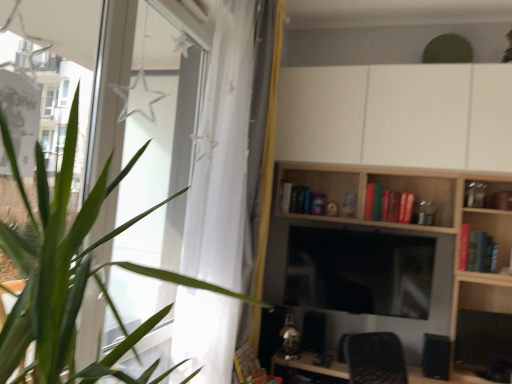
Question: Considering the relative sizes of green leafy plant at left and white sheer curtain at left in the image provided, is green leafy plant at left shorter than white sheer curtain at left?

Choices:
 (A) yes
 (B) no

Answer: (A)

Question: Is green leafy plant at left facing away from white sheer curtain at left?

Choices:
 (A) yes
 (B) no

Answer: (B)

Question: Can you confirm if green leafy plant at left is thinner than white sheer curtain at left?

Choices:
 (A) yes
 (B) no

Answer: (B)

Question: Does green leafy plant at left lie in front of white sheer curtain at left?

Choices:
 (A) no
 (B) yes

Answer: (B)

Question: Does green leafy plant at left appear on the left side of white sheer curtain at left?

Choices:
 (A) no
 (B) yes

Answer: (B)

Question: Considering the positions of green matte book at upper center, positioned as the second book in back-to-front order, and white matte cabinet at upper center in the image, is green matte book at upper center, positioned as the second book in back-to-front order, wider or thinner than white matte cabinet at upper center?

Choices:
 (A) thin
 (B) wide

Answer: (A)

Question: Is green matte book at upper center, which is the second book from right to left, spatially inside white matte cabinet at upper center, or outside of it?

Choices:
 (A) inside
 (B) outside

Answer: (B)

Question: Is point (370, 213) closer or farther from the camera than point (335, 105)?

Choices:
 (A) farther
 (B) closer

Answer: (A)

Question: From a real-world perspective, is green matte book at upper center, the second book when ordered from front to back, physically located above or below white matte cabinet at upper center?

Choices:
 (A) above
 (B) below

Answer: (B)

Question: Considering the positions of white matte cabinet at upper center and white sheer curtain at left in the image, is white matte cabinet at upper center wider or thinner than white sheer curtain at left?

Choices:
 (A) wide
 (B) thin

Answer: (A)

Question: In terms of height, does white matte cabinet at upper center look taller or shorter compared to white sheer curtain at left?

Choices:
 (A) tall
 (B) short

Answer: (B)

Question: From the image's perspective, is white matte cabinet at upper center positioned above or below white sheer curtain at left?

Choices:
 (A) below
 (B) above

Answer: (B)

Question: Is point tap(343, 150) closer or farther from the camera than point tap(236, 172)?

Choices:
 (A) closer
 (B) farther

Answer: (B)

Question: Is point (367, 218) closer or farther from the camera than point (488, 264)?

Choices:
 (A) closer
 (B) farther

Answer: (B)

Question: Relative to hardcover book at center, the first book viewed from the front, is green matte book at upper center, the second book when ordered from front to back, in front or behind?

Choices:
 (A) front
 (B) behind

Answer: (B)